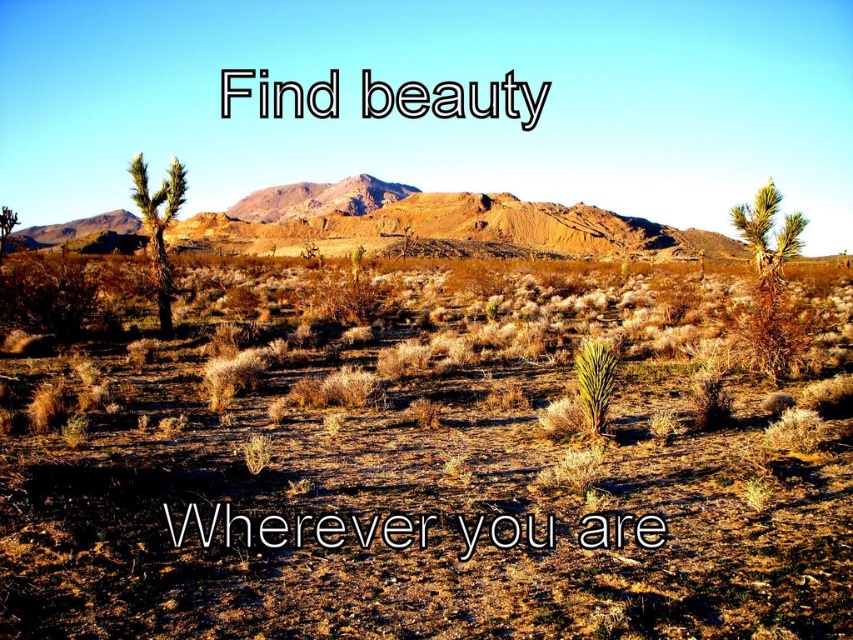
Who is shorter, brown rocky mountain at center or green spiky cactus at right?

With less height is green spiky cactus at right.

Is brown rocky mountain at center positioned behind green spiky cactus at right?

Yes, brown rocky mountain at center is further from the viewer.

Locate an element on the screen. This screenshot has height=640, width=853. brown rocky mountain at center is located at coordinates (440, 221).

I want to click on brown rocky mountain at center, so click(440, 221).

Is brown dry grass at center smaller than green spiky cactus at left?

Actually, brown dry grass at center might be larger than green spiky cactus at left.

Which of these two, brown dry grass at center or green spiky cactus at left, stands taller?

green spiky cactus at left

Between point (190, 566) and point (167, 172), which one is positioned in front?

Point (190, 566)

I want to click on brown dry grass at center, so click(432, 464).

Which is more to the right, brown dry grass at center or green spiky cactus at center?

From the viewer's perspective, green spiky cactus at center appears more on the right side.

Can you confirm if brown dry grass at center is taller than green spiky cactus at center?

Correct, brown dry grass at center is much taller as green spiky cactus at center.

Locate an element on the screen. The height and width of the screenshot is (640, 853). brown dry grass at center is located at coordinates (432, 464).